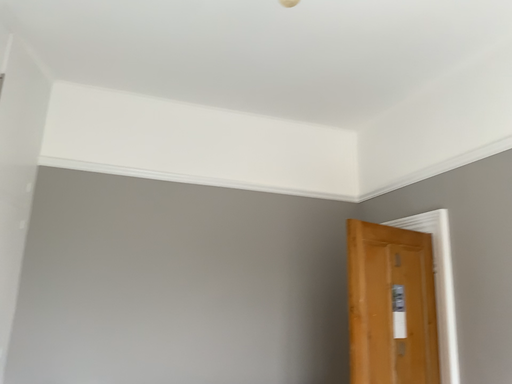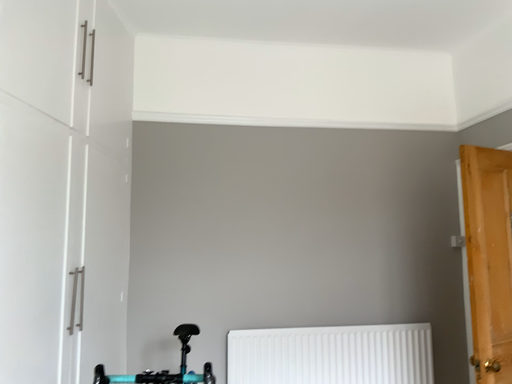
Question: Which way did the camera rotate in the video?

Choices:
 (A) rotated right
 (B) rotated left

Answer: (B)